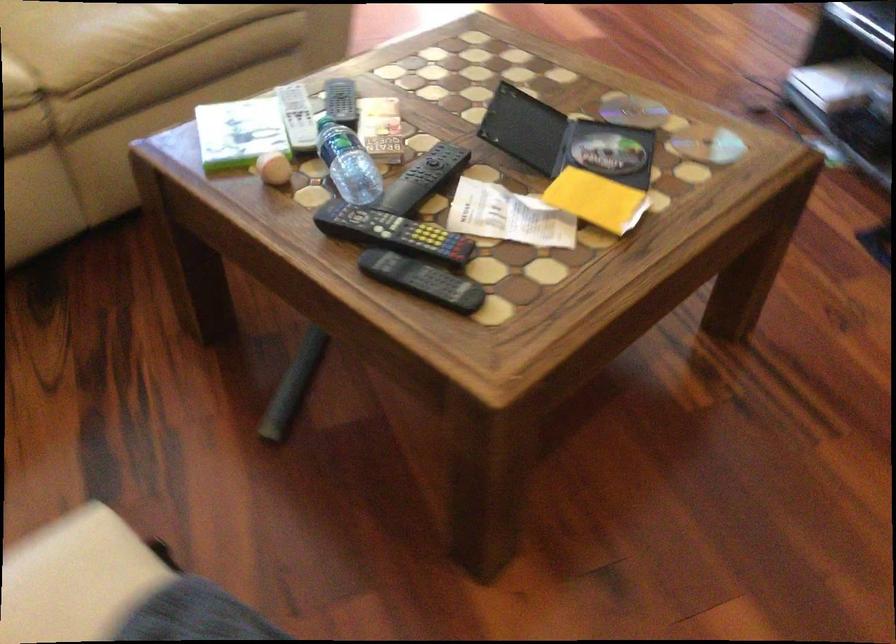
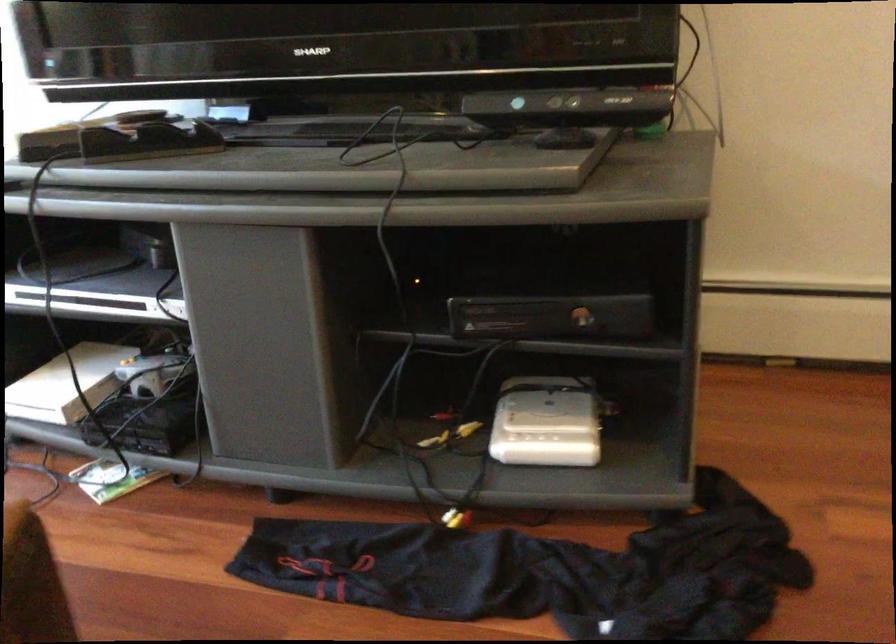
Question: The camera is either moving clockwise (left) or counter-clockwise (right) around the object. The first image is from the beginning of the video and the second image is from the end. Is the camera moving left or right when shooting the video?

Choices:
 (A) Left
 (B) Right

Answer: (A)